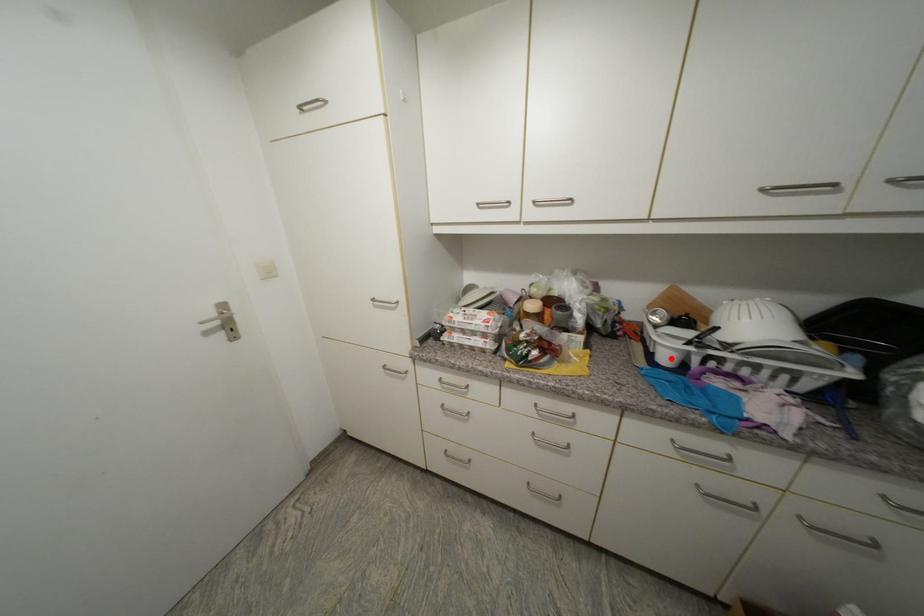
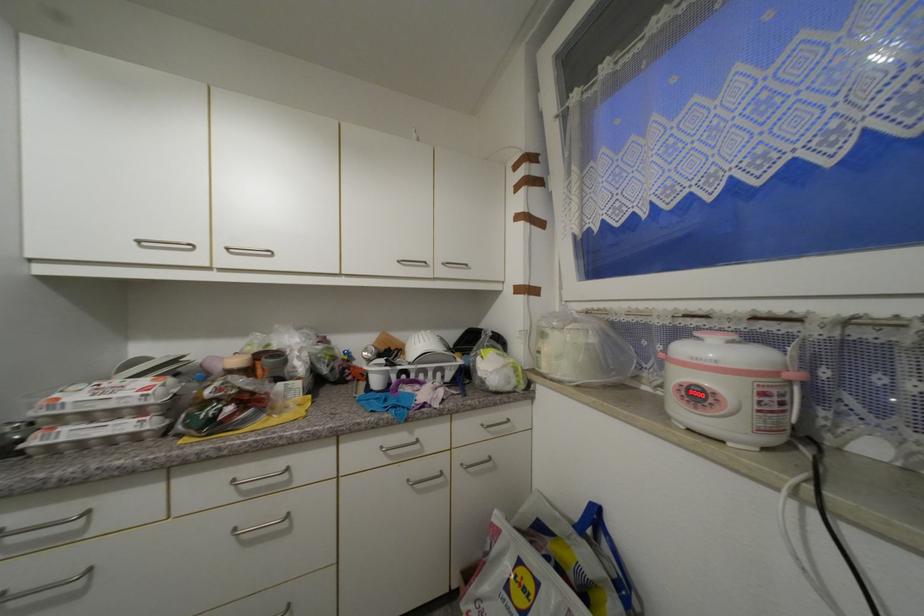
In the second image, find the point that corresponds to the highlighted location in the first image.

(382, 384)